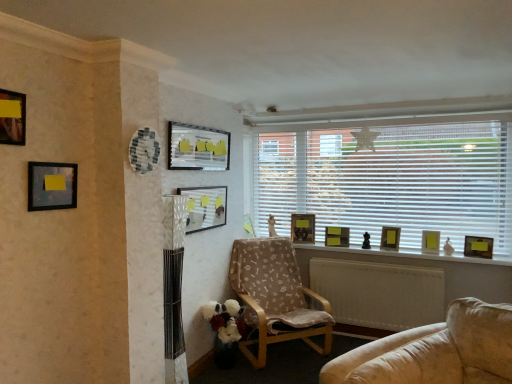
Locate an element on the screen. This screenshot has height=384, width=512. free space to the left of yellow matte picture frame at right, the 6th picture frame from the front is located at coordinates [416, 252].